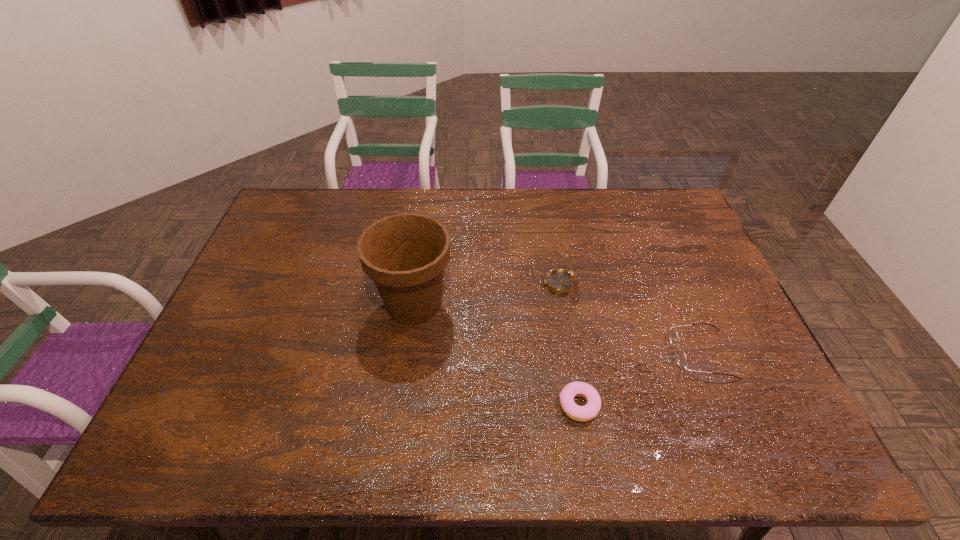
Find the location of a particular element. Image resolution: width=960 pixels, height=540 pixels. the leftmost object is located at coordinates (405, 254).

At what (x,y) coordinates should I click in order to perform the action: click on the tallest object. Please return your answer as a coordinate pair (x, y). This screenshot has height=540, width=960. Looking at the image, I should click on (405, 254).

This screenshot has height=540, width=960. What are the coordinates of `compass` in the screenshot? It's located at (559, 281).

The height and width of the screenshot is (540, 960). I want to click on spectacles, so click(x=681, y=356).

At what (x,y) coordinates should I click in order to perform the action: click on the second shortest object. Please return your answer as a coordinate pair (x, y). The image size is (960, 540). Looking at the image, I should click on (681, 356).

Where is `doughnut`? Image resolution: width=960 pixels, height=540 pixels. doughnut is located at coordinates (585, 413).

The image size is (960, 540). Find the location of `the nearest object`. the nearest object is located at coordinates (585, 413).

Where is `free location located 0.230m on the back of the tallest object`? free location located 0.230m on the back of the tallest object is located at coordinates (424, 227).

Identify the location of blank space located with the dial facing the compass. This screenshot has height=540, width=960. (491, 284).

The width and height of the screenshot is (960, 540). I want to click on free space located 0.150m with the dial facing the compass, so click(491, 284).